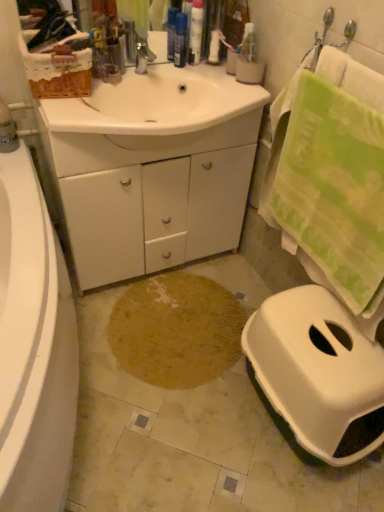
Measure the distance between white plastic toilet at lower right and camera.

The distance of white plastic toilet at lower right from camera is 1.19 meters.

The image size is (384, 512). Find the location of `white glossy tube at upper center, which is counted as the 2th toiletry, starting from the left`. white glossy tube at upper center, which is counted as the 2th toiletry, starting from the left is located at coordinates (196, 32).

You are a GUI agent. You are given a task and a screenshot of the screen. Output one action in this format:
    pyautogui.click(x=<x>, y=<y>)
    Task: Click on the green textured towel at right
    The image size is (384, 512).
    Given the screenshot: What is the action you would take?
    pyautogui.click(x=329, y=185)

What is the approximate width of white glossy cabinet at center?

The width of white glossy cabinet at center is 18.05 inches.

Locate an element on the screen. The height and width of the screenshot is (512, 384). white plastic bottle at upper center, marked as the first toiletry in a right-to-left arrangement is located at coordinates (215, 46).

Image resolution: width=384 pixels, height=512 pixels. I want to click on white plastic toilet at lower right, so click(x=318, y=373).

Is white glossy sink at center oriented towards green textured towel at right?

Yes, white glossy sink at center is oriented towards green textured towel at right.

Would you consider white glossy sink at center to be distant from green textured towel at right?

No, white glossy sink at center is not far from green textured towel at right.

From the image's perspective, is white glossy sink at center below green textured towel at right?

No, from the image's perspective, white glossy sink at center is not below green textured towel at right.

In the scene shown: How much distance is there between white glossy tube at upper center, which is counted as the 2th toiletry, starting from the left, and white plastic bottle at upper center, which is the 3th toiletry in left-to-right order?

white glossy tube at upper center, which is counted as the 2th toiletry, starting from the left, and white plastic bottle at upper center, which is the 3th toiletry in left-to-right order, are 7.84 centimeters apart.

Identify the location of toiletry on the right of white glossy tube at upper center, which is counted as the second toiletry, starting from the right. (215, 46).

Is the position of white glossy tube at upper center, which is counted as the second toiletry, starting from the right, less distant than that of white plastic bottle at upper center, marked as the first toiletry in a right-to-left arrangement?

That is True.

Does white glossy tube at upper center, which is counted as the 2th toiletry, starting from the left, turn towards white plastic bottle at upper center, which is the 3th toiletry in left-to-right order?

No, white glossy tube at upper center, which is counted as the 2th toiletry, starting from the left, is not oriented towards white plastic bottle at upper center, which is the 3th toiletry in left-to-right order.

How many degrees apart are the facing directions of brown textured rug at center and white glossy cabinet at center?

3.28 degrees separate the facing orientations of brown textured rug at center and white glossy cabinet at center.

Based on the photo, considering the sizes of objects brown textured rug at center and white glossy cabinet at center in the image provided, who is thinner, brown textured rug at center or white glossy cabinet at center?

white glossy cabinet at center is thinner.

Is brown textured rug at center to the left or to the right of white glossy cabinet at center in the image?

Based on their positions, brown textured rug at center is located to the right of white glossy cabinet at center.

At what (x,y) coordinates should I click in order to perform the action: click on bathroom cabinet on the left of brown textured rug at center. Please return your answer as a coordinate pair (x, y). The image size is (384, 512). Looking at the image, I should click on (153, 166).

Can you confirm if white glossy tube at upper center, which is counted as the 2th toiletry, starting from the left, is shorter than white plastic toilet at lower right?

Yes, white glossy tube at upper center, which is counted as the 2th toiletry, starting from the left, is shorter than white plastic toilet at lower right.

From a real-world perspective, is white glossy tube at upper center, which is counted as the second toiletry, starting from the right, over white plastic toilet at lower right?

Yes, from a real-world perspective, white glossy tube at upper center, which is counted as the second toiletry, starting from the right, is over white plastic toilet at lower right

I want to click on toilet on the right of white glossy tube at upper center, which is counted as the second toiletry, starting from the right, so click(318, 373).

From the white plastic bottle at upper center, marked as the first toiletry in a right-to-left arrangement, count 2nd toiletrys forward and point to it. Please provide its 2D coordinates.

[(196, 32)]

Would you say white plastic bottle at upper center, marked as the first toiletry in a right-to-left arrangement, is inside or outside white glossy tube at upper center, which is counted as the second toiletry, starting from the right?

white plastic bottle at upper center, marked as the first toiletry in a right-to-left arrangement, lies outside white glossy tube at upper center, which is counted as the second toiletry, starting from the right.

Between white plastic bottle at upper center, which is the 3th toiletry in left-to-right order, and white glossy tube at upper center, which is counted as the second toiletry, starting from the right, which one is positioned behind?

white plastic bottle at upper center, which is the 3th toiletry in left-to-right order.

From the image's perspective, between white plastic bottle at upper center, which is the 3th toiletry in left-to-right order, and white glossy tube at upper center, which is counted as the 2th toiletry, starting from the left, who is located below?

white plastic bottle at upper center, which is the 3th toiletry in left-to-right order, from the image's perspective.

Are green textured towel at right and white glossy sink at center located far from each other?

Actually, green textured towel at right and white glossy sink at center are a little close together.

Does point (301, 129) lie behind point (172, 106)?

No, (301, 129) is closer to viewer.

This screenshot has height=512, width=384. I want to click on bath towel that is under the white glossy sink at center (from a real-world perspective), so click(x=329, y=185).

Does white plastic toilet at lower right turn towards brown textured rug at center?

No.

Is point (381, 412) positioned in front of point (195, 281)?

Yes, point (381, 412) is in front of point (195, 281).

Visually, is white plastic toilet at lower right positioned to the left or to the right of brown textured rug at center?

Clearly, white plastic toilet at lower right is on the right of brown textured rug at center in the image.

Identify the location of sink positioned vertically above the green textured towel at right (from a real-world perspective). This screenshot has height=512, width=384. (156, 106).

This screenshot has height=512, width=384. Find the location of `the 1st toiletry below when counting from the white glossy tube at upper center, which is counted as the 2th toiletry, starting from the left (from the image's perspective)`. the 1st toiletry below when counting from the white glossy tube at upper center, which is counted as the 2th toiletry, starting from the left (from the image's perspective) is located at coordinates (215, 46).

From the image, which object appears to be farther from white plastic bottle at upper center, which is the 3th toiletry in left-to-right order, brown textured rug at center or white glossy tube at upper center, which is counted as the 2th toiletry, starting from the left?

Among the two, brown textured rug at center is located further to white plastic bottle at upper center, which is the 3th toiletry in left-to-right order.

When comparing their distances from white plastic bottle at upper center, which is the 3th toiletry in left-to-right order, does white plastic toilet at lower right or brown textured rug at center seem closer?

brown textured rug at center lies closer to white plastic bottle at upper center, which is the 3th toiletry in left-to-right order, than the other object.

When comparing their distances from brown textured rug at center, does white glossy cabinet at center or white plastic toilet at lower right seem further?

Among the two, white glossy cabinet at center is located further to brown textured rug at center.

Estimate the real-world distances between objects in this image. Which object is further from green textured towel at right, white plastic bottle at upper center, marked as the first toiletry in a right-to-left arrangement, or white glossy sink at center?

white plastic bottle at upper center, marked as the first toiletry in a right-to-left arrangement, is positioned further to the anchor green textured towel at right.

Considering their positions, is white glossy cabinet at center positioned further to white glossy tube at upper center, which is counted as the second toiletry, starting from the right, than green textured towel at right?

green textured towel at right lies further to white glossy tube at upper center, which is counted as the second toiletry, starting from the right, than the other object.

Looking at the image, which one is located further to white plastic toilet at lower right, translucent plastic bottles at upper center, the 3th toiletry from the right, or white glossy sink at center?

translucent plastic bottles at upper center, the 3th toiletry from the right, is further to white plastic toilet at lower right.

Based on their spatial positions, is white glossy cabinet at center or white plastic toilet at lower right closer to white plastic bottle at upper center, marked as the first toiletry in a right-to-left arrangement?

white glossy cabinet at center is positioned closer to the anchor white plastic bottle at upper center, marked as the first toiletry in a right-to-left arrangement.

When comparing their distances from translucent plastic bottles at upper center, the 3th toiletry from the right, does white plastic toilet at lower right or brown textured rug at center seem closer?

brown textured rug at center is positioned closer to the anchor translucent plastic bottles at upper center, the 3th toiletry from the right.

You are a GUI agent. You are given a task and a screenshot of the screen. Output one action in this format:
    pyautogui.click(x=<x>, y=<y>)
    Task: Click on the footprint between translucent plastic bottles at upper center, marked as the first toiletry in a left-to-right arrangement, and white plastic toilet at lower right in the up-down direction
    
    Given the screenshot: What is the action you would take?
    pyautogui.click(x=176, y=330)

This screenshot has width=384, height=512. I want to click on bathroom cabinet between translucent plastic bottles at upper center, marked as the first toiletry in a left-to-right arrangement, and brown textured rug at center from top to bottom, so coord(153,166).

Locate an element on the screen. bathroom cabinet between white plastic bottle at upper center, marked as the first toiletry in a right-to-left arrangement, and brown textured rug at center from top to bottom is located at coordinates (153, 166).

Locate an element on the screen. The height and width of the screenshot is (512, 384). footprint between white glossy tube at upper center, which is counted as the second toiletry, starting from the right, and white plastic toilet at lower right from top to bottom is located at coordinates (176, 330).